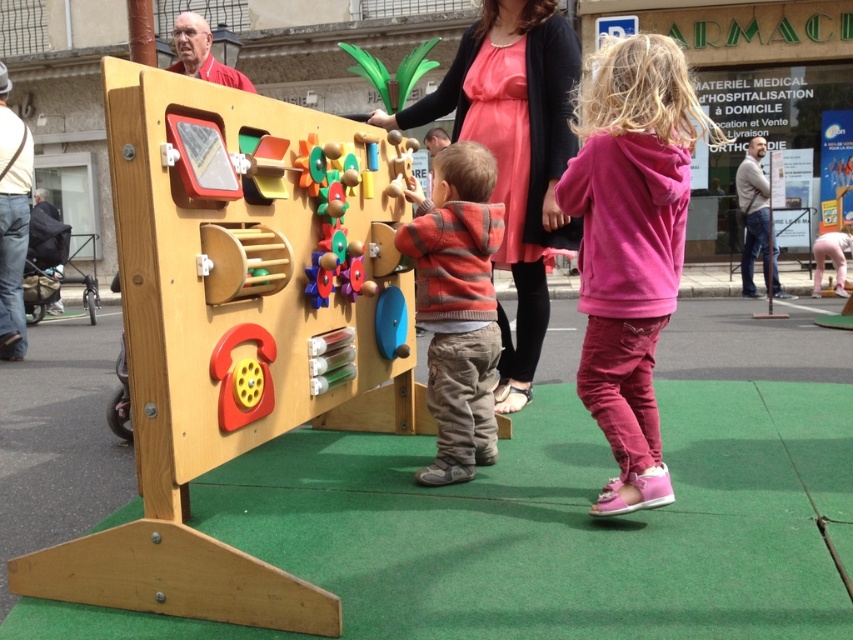
Consider the image. You are a photographer trying to capture a group photo of the children in front of the play structure. You need to ensure both the pink fleece hoodie at right and the striped sweater at center are fully visible in the frame. Which child should you position closer to the center to avoid cropping either of their outfits?

The pink fleece hoodie at right is wider than the striped sweater at center, so positioning the child in the pink fleece hoodie at right closer to the center will help ensure both outfits are fully visible without cropping.

Based on the photo, you are a photographer at the event and want to capture both the pink fleece hoodie at right and the matte pink dress at center in a single frame. Which object should you focus on first to ensure both are in the frame?

The pink fleece hoodie at right is below the matte pink dress at center, so you should focus on the matte pink dress at center first to ensure both are in the frame.